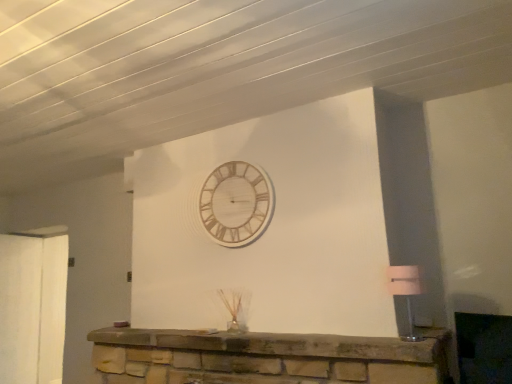
Question: Does wooden/textured wall clock at upper center have a larger size compared to matte white lampshade at right?

Choices:
 (A) no
 (B) yes

Answer: (B)

Question: Is wooden/textured wall clock at upper center in front of matte white lampshade at right?

Choices:
 (A) yes
 (B) no

Answer: (B)

Question: Is wooden/textured wall clock at upper center positioned far away from matte white lampshade at right?

Choices:
 (A) no
 (B) yes

Answer: (B)

Question: Is wooden/textured wall clock at upper center turned away from matte white lampshade at right?

Choices:
 (A) no
 (B) yes

Answer: (A)

Question: Can you confirm if wooden/textured wall clock at upper center is taller than matte white lampshade at right?

Choices:
 (A) no
 (B) yes

Answer: (B)

Question: From the image's perspective, would you say wooden/textured wall clock at upper center is positioned over matte white lampshade at right?

Choices:
 (A) yes
 (B) no

Answer: (A)

Question: Is matte white lampshade at right not within stone fireplace at center?

Choices:
 (A) no
 (B) yes

Answer: (B)

Question: Does matte white lampshade at right contain stone fireplace at center?

Choices:
 (A) yes
 (B) no

Answer: (B)

Question: From the image's perspective, is matte white lampshade at right located above stone fireplace at center?

Choices:
 (A) no
 (B) yes

Answer: (B)

Question: Is matte white lampshade at right facing towards stone fireplace at center?

Choices:
 (A) yes
 (B) no

Answer: (B)

Question: From a real-world perspective, is matte white lampshade at right on stone fireplace at center?

Choices:
 (A) yes
 (B) no

Answer: (A)

Question: Is matte white lampshade at right next to stone fireplace at center?

Choices:
 (A) yes
 (B) no

Answer: (B)

Question: Is wooden/textured wall clock at upper center a part of stone fireplace at center?

Choices:
 (A) yes
 (B) no

Answer: (B)